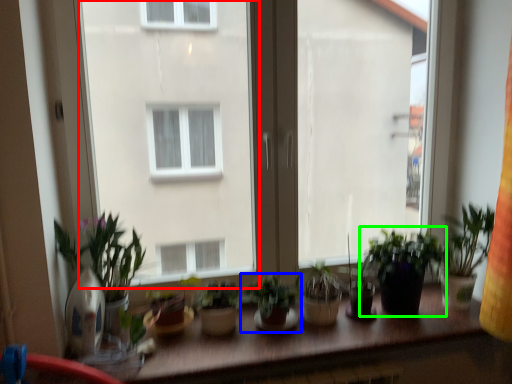
Question: Which object is positioned farthest from window screen (highlighted by a red box)? Select from houseplant (highlighted by a blue box) and houseplant (highlighted by a green box).

Choices:
 (A) houseplant
 (B) houseplant

Answer: (A)